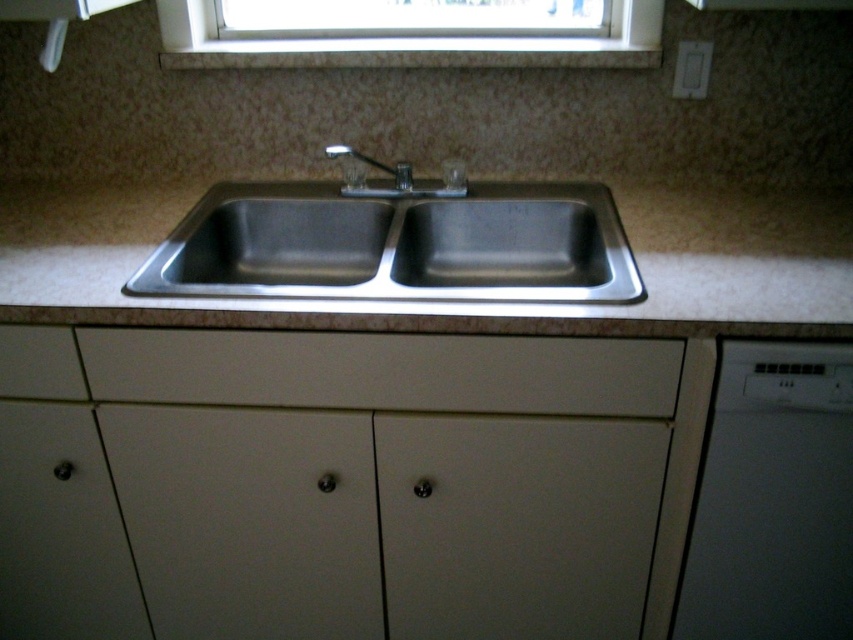
You are a kitchen designer planning to install a new faucet. The faucet requires a minimum of 60 cm of space between the stainless steel sink at center and the white matte drawer at center. Based on the current setup, will there be enough space?

The stainless steel sink at center has a lesser width compared to the white matte drawer at center, but the exact distance between them is not provided. Therefore, it is impossible to determine if there is enough space for the faucet installation based solely on the given information.